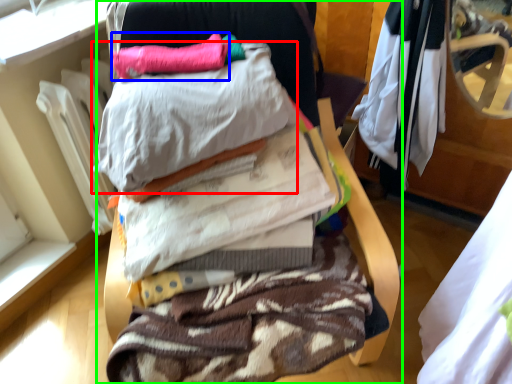
Question: Considering the real-world distances, which object is farthest from pillow (highlighted by a red box)? pillow (highlighted by a blue box) or furniture (highlighted by a green box)?

Choices:
 (A) pillow
 (B) furniture

Answer: (B)